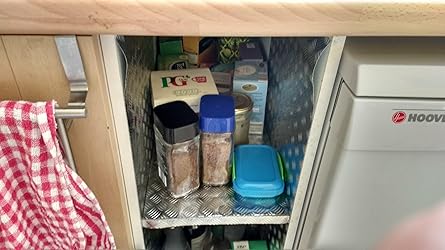
Find the location of a particular element. This screenshot has width=445, height=250. tupperware is located at coordinates (267, 176).